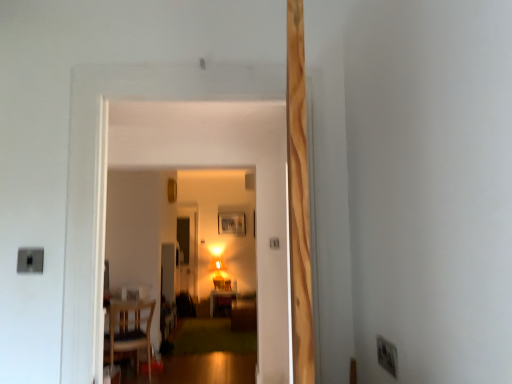
Question: Is wooden chair at lower left shorter than matte wooden table at center?

Choices:
 (A) no
 (B) yes

Answer: (A)

Question: From a real-world perspective, is wooden chair at lower left under matte wooden table at center?

Choices:
 (A) no
 (B) yes

Answer: (A)

Question: From the image's perspective, would you say wooden chair at lower left is shown under matte wooden table at center?

Choices:
 (A) yes
 (B) no

Answer: (B)

Question: Is matte wooden table at center completely or partially inside wooden chair at lower left?

Choices:
 (A) yes
 (B) no

Answer: (B)

Question: Does wooden chair at lower left appear on the left side of matte wooden table at center?

Choices:
 (A) yes
 (B) no

Answer: (A)

Question: Is wooden picture frame at center inside the boundaries of wooden chair at lower left, or outside?

Choices:
 (A) outside
 (B) inside

Answer: (A)

Question: From a real-world perspective, is wooden picture frame at center above or below wooden chair at lower left?

Choices:
 (A) above
 (B) below

Answer: (A)

Question: From the image's perspective, is wooden picture frame at center above or below wooden chair at lower left?

Choices:
 (A) above
 (B) below

Answer: (A)

Question: Considering the positions of wooden picture frame at center and wooden chair at lower left in the image, is wooden picture frame at center taller or shorter than wooden chair at lower left?

Choices:
 (A) tall
 (B) short

Answer: (B)

Question: Considering their positions, is white plastic electric outlet at lower right located in front of or behind matte wooden table at center?

Choices:
 (A) front
 (B) behind

Answer: (A)

Question: From a real-world perspective, is white plastic electric outlet at lower right positioned above or below matte wooden table at center?

Choices:
 (A) above
 (B) below

Answer: (A)

Question: Is point (396, 372) closer or farther from the camera than point (224, 306)?

Choices:
 (A) closer
 (B) farther

Answer: (A)

Question: Is white plastic electric outlet at lower right taller or shorter than matte wooden table at center?

Choices:
 (A) tall
 (B) short

Answer: (B)

Question: Is point (209, 302) positioned closer to the camera than point (388, 344)?

Choices:
 (A) closer
 (B) farther

Answer: (B)

Question: From the image's perspective, is matte wooden table at center located above or below white plastic electric outlet at lower right?

Choices:
 (A) below
 (B) above

Answer: (A)